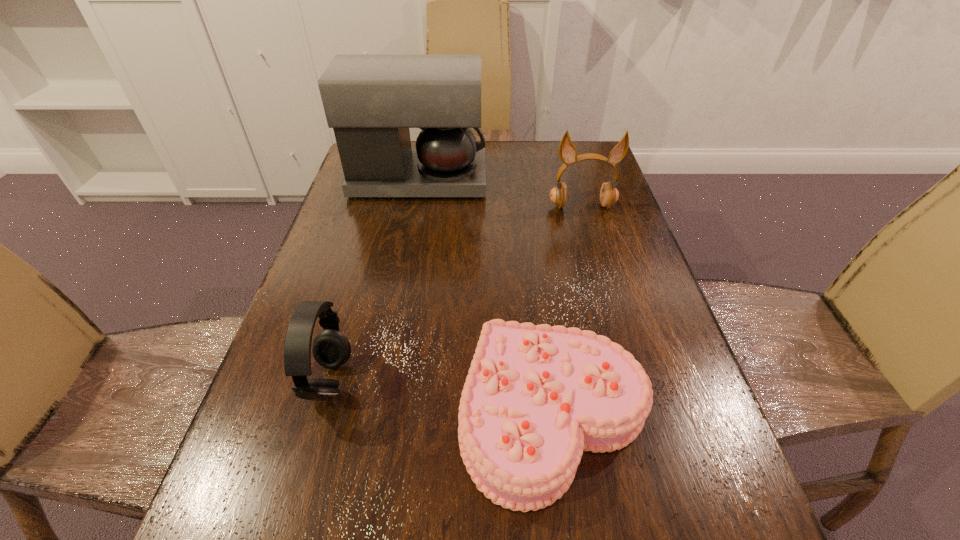
Locate which object is the third closest to the shortest object. Please provide its 2D coordinates. Your answer should be formatted as a tuple, i.e. [(x, y)], where the tuple contains the x and y coordinates of a point satisfying the conditions above.

[(370, 100)]

This screenshot has width=960, height=540. In order to click on free space that satisfies the following two spatial constraints: 1. on the ear cups of the third tallest object; 2. on the right side of the shortest object in this screenshot , I will do `click(321, 415)`.

Where is `vacant space that satisfies the following two spatial constraints: 1. on the ear cups of the nearer earphone; 2. on the back side of the shortest object`? The width and height of the screenshot is (960, 540). vacant space that satisfies the following two spatial constraints: 1. on the ear cups of the nearer earphone; 2. on the back side of the shortest object is located at coordinates (321, 415).

You are a GUI agent. You are given a task and a screenshot of the screen. Output one action in this format:
    pyautogui.click(x=<x>, y=<y>)
    Task: Click on the free location that satisfies the following two spatial constraints: 1. on the carafe side of the coffee maker; 2. on the back side of the cake
    The image size is (960, 540).
    Given the screenshot: What is the action you would take?
    pyautogui.click(x=374, y=415)

You are a GUI agent. You are given a task and a screenshot of the screen. Output one action in this format:
    pyautogui.click(x=<x>, y=<y>)
    Task: Click on the vacant space that satisfies the following two spatial constraints: 1. on the ear cups of the cake; 2. on the right side of the nearer earphone
    This screenshot has height=540, width=960.
    Given the screenshot: What is the action you would take?
    pyautogui.click(x=321, y=415)

Find the location of a particular element. The image size is (960, 540). free spot that satisfies the following two spatial constraints: 1. on the ear cups of the nearer earphone; 2. on the right side of the shortest object is located at coordinates (321, 415).